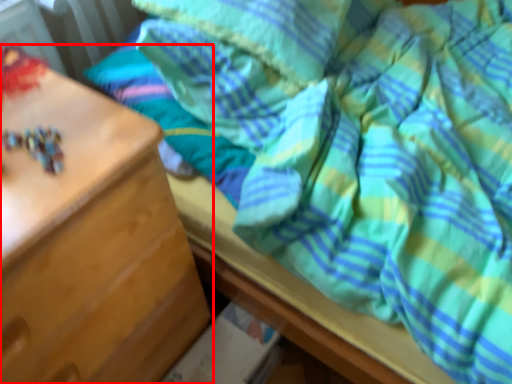
Question: Where is chest of drawers (annotated by the red box) located in relation to pillow in the image?

Choices:
 (A) right
 (B) left

Answer: (B)